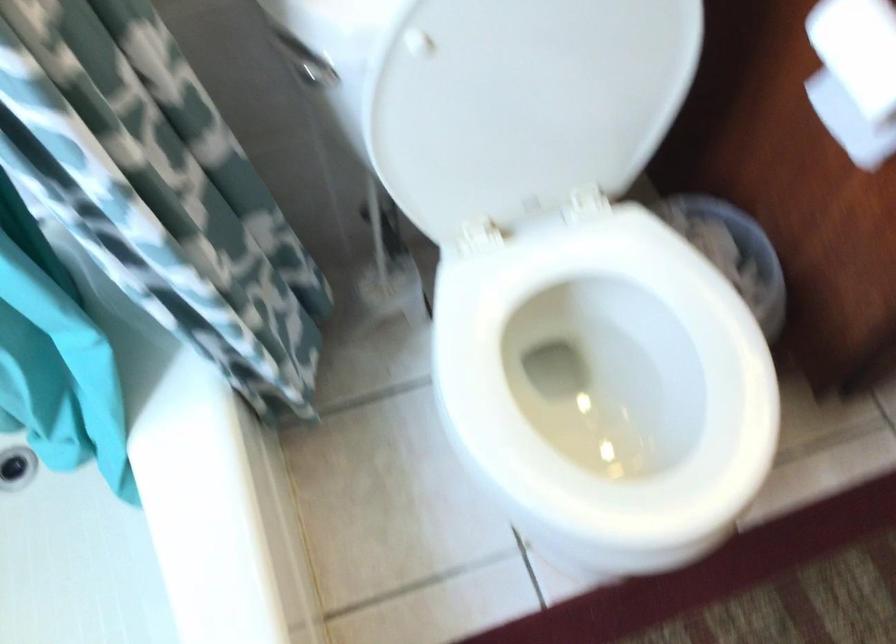
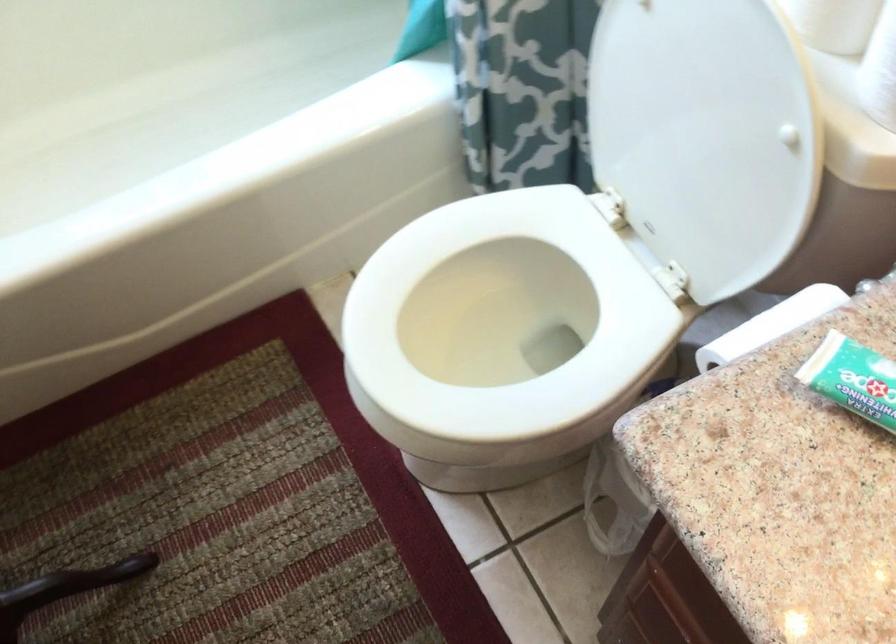
How did the camera likely rotate?

The camera's rotation is toward left-down.